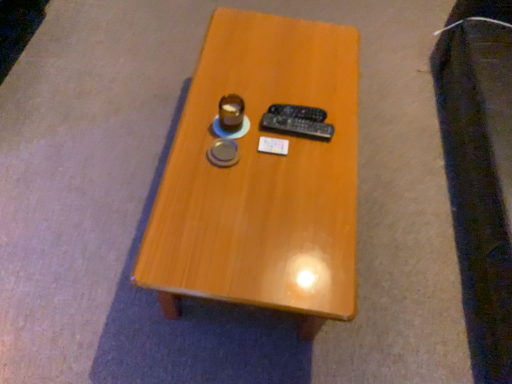
The height and width of the screenshot is (384, 512). I want to click on vacant area that is situated to the right of black plastic remote control at center, arranged as the 1th remote control when viewed from the back, so click(x=334, y=118).